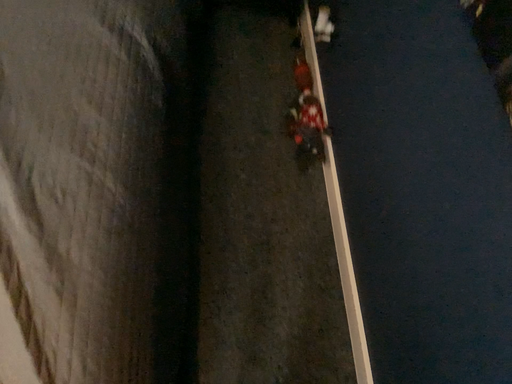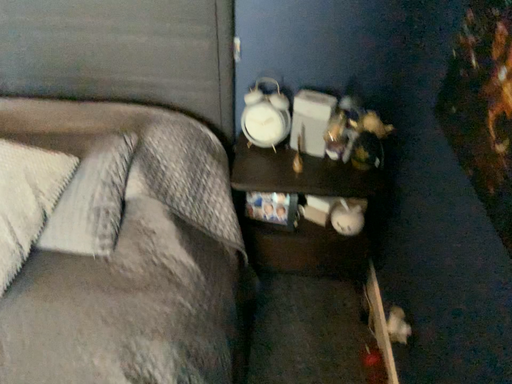
Question: Which way did the camera rotate in the video?

Choices:
 (A) rotated upward
 (B) rotated downward

Answer: (A)